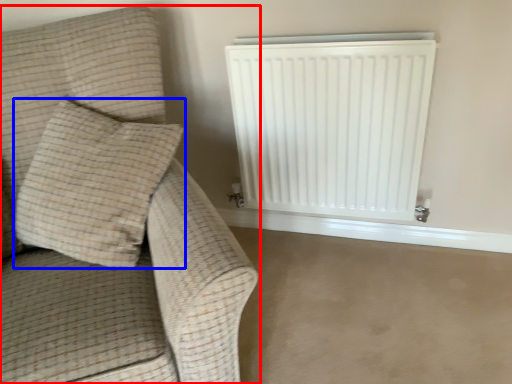
Question: Which object appears farthest to the camera in this image, furniture (highlighted by a red box) or pillow (highlighted by a blue box)?

Choices:
 (A) furniture
 (B) pillow

Answer: (B)